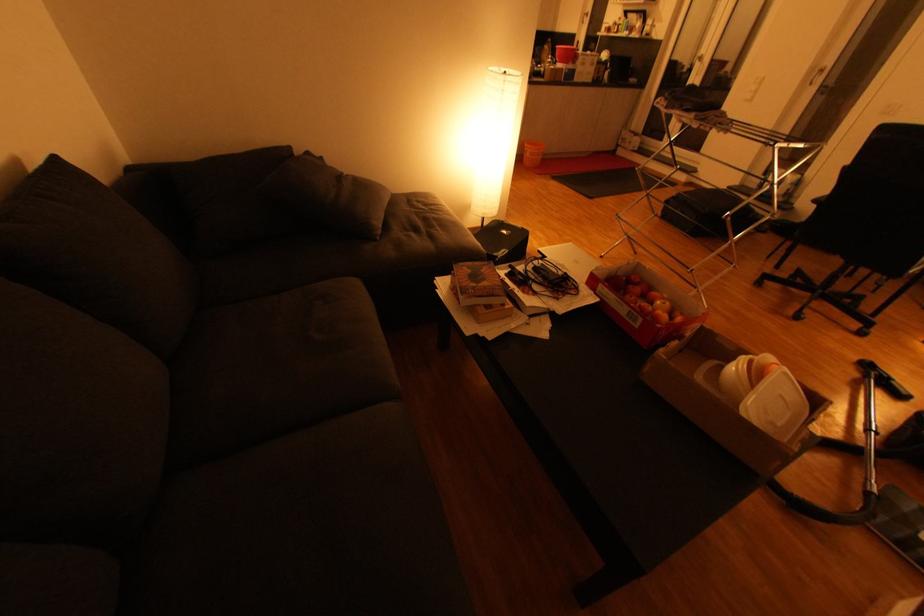
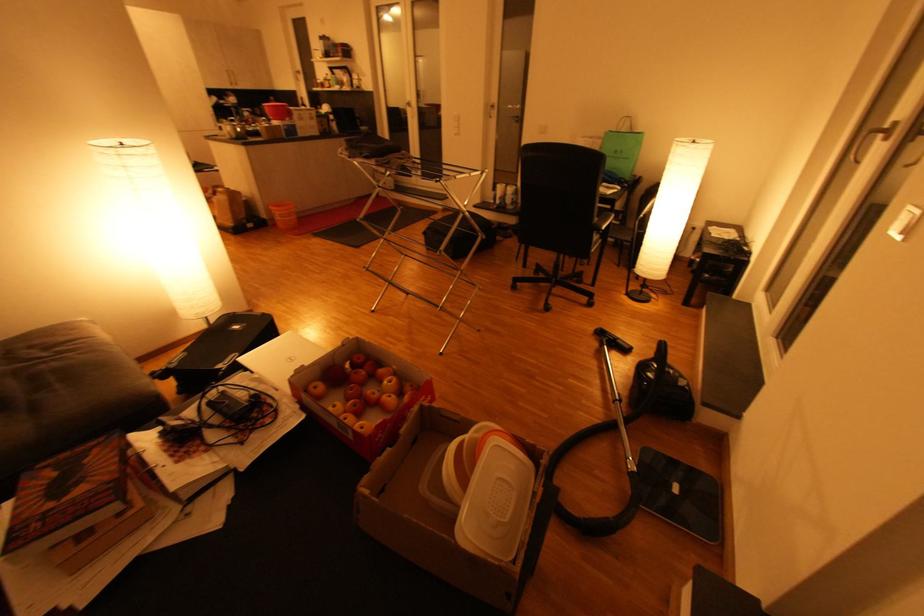
In the second image, find the point that corresponds to (560,63) in the first image.

(274, 121)